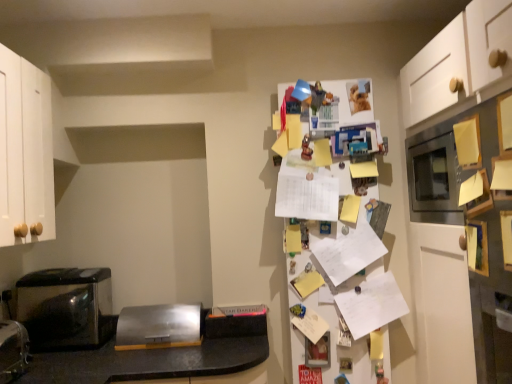
Question: From a real-world perspective, is white paper covered fridge at upper right located beneath satin silver toaster at center, which is the second appliance from left to right?

Choices:
 (A) no
 (B) yes

Answer: (A)

Question: From a real-world perspective, is white paper covered fridge at upper right on top of satin silver toaster at center, which is the second appliance from left to right?

Choices:
 (A) no
 (B) yes

Answer: (B)

Question: Is white paper covered fridge at upper right located outside satin silver toaster at center, which is the second appliance from left to right?

Choices:
 (A) yes
 (B) no

Answer: (A)

Question: Is white paper covered fridge at upper right wider than satin silver toaster at center, which is the second appliance from left to right?

Choices:
 (A) yes
 (B) no

Answer: (B)

Question: Can you confirm if white paper covered fridge at upper right is taller than satin silver toaster at center, the 2th appliance positioned from the front?

Choices:
 (A) no
 (B) yes

Answer: (B)

Question: From the image's perspective, is white paper at center located above or below black stainless steel microwave at lower left, marked as the 2th appliance in a right-to-left arrangement?

Choices:
 (A) above
 (B) below

Answer: (A)

Question: Considering the positions of white paper at center and black stainless steel microwave at lower left, the 1th appliance in the front-to-back sequence, in the image, is white paper at center wider or thinner than black stainless steel microwave at lower left, the 1th appliance in the front-to-back sequence,?

Choices:
 (A) thin
 (B) wide

Answer: (A)

Question: From a real-world perspective, relative to black stainless steel microwave at lower left, positioned as the first appliance in left-to-right order, is white paper at center vertically above or below?

Choices:
 (A) below
 (B) above

Answer: (B)

Question: Is white paper at center inside or outside of black stainless steel microwave at lower left, the 2th appliance in the back-to-front sequence?

Choices:
 (A) outside
 (B) inside

Answer: (A)

Question: Does point (28, 292) appear closer or farther from the camera than point (377, 284)?

Choices:
 (A) farther
 (B) closer

Answer: (A)

Question: Is metallic black toaster at left inside or outside of white paper at center?

Choices:
 (A) inside
 (B) outside

Answer: (B)

Question: From a real-world perspective, is metallic black toaster at left positioned above or below white paper at center?

Choices:
 (A) above
 (B) below

Answer: (A)

Question: Is metallic black toaster at left bigger or smaller than white paper at center?

Choices:
 (A) big
 (B) small

Answer: (A)

Question: From a real-world perspective, is black stainless steel microwave at lower left, positioned as the first appliance in left-to-right order, above or below metallic black toaster at left?

Choices:
 (A) above
 (B) below

Answer: (B)

Question: Is point (7, 380) positioned closer to the camera than point (71, 342)?

Choices:
 (A) closer
 (B) farther

Answer: (A)